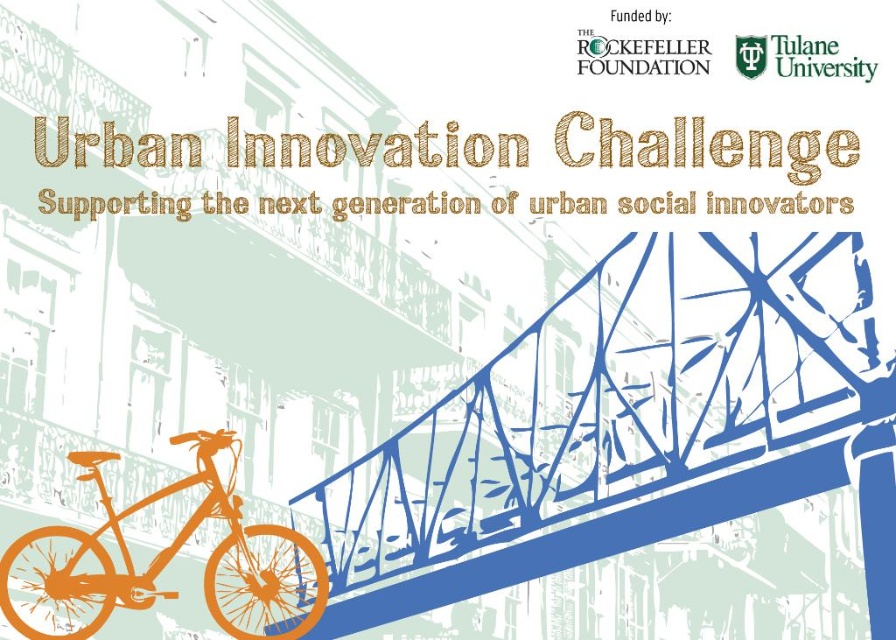
Is blue steel pedestrian bridge at center to the right of orange matte bicycle at lower left from the viewer's perspective?

Correct, you'll find blue steel pedestrian bridge at center to the right of orange matte bicycle at lower left.

Does blue steel pedestrian bridge at center lie in front of orange matte bicycle at lower left?

No, it is not.

This screenshot has height=640, width=896. What are the coordinates of `blue steel pedestrian bridge at center` in the screenshot? It's located at (625, 429).